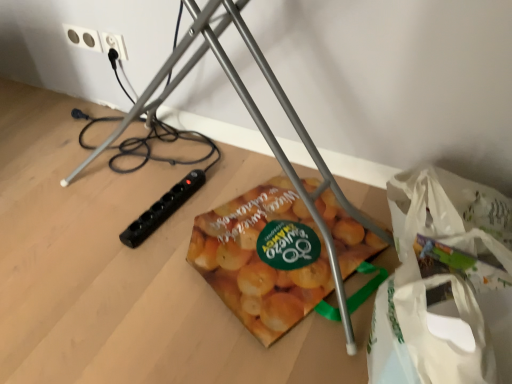
Question: Is black plastic power plug at upper left, acting as the second power plugs and sockets starting from the left, in front of or behind white plastic bag at lower right in the image?

Choices:
 (A) front
 (B) behind

Answer: (B)

Question: Is black plastic power plug at upper left, marked as the first power plugs and sockets in a right-to-left arrangement, taller or shorter than white plastic bag at lower right?

Choices:
 (A) tall
 (B) short

Answer: (B)

Question: Which object is the closest to the black plastic power plug at upper left, marked as the first power plugs and sockets in a right-to-left arrangement?

Choices:
 (A) metallic tripod at center
 (B) white plastic power plugs and sockets at upper left, the 1th power plugs and sockets viewed from the left
 (C) matte plastic bag of sweet potatoes at center
 (D) white plastic bag at lower right

Answer: (B)

Question: Estimate the real-world distances between objects in this image. Which object is farther from the metallic tripod at center?

Choices:
 (A) matte plastic bag of sweet potatoes at center
 (B) black plastic power plug at upper left, acting as the second power plugs and sockets starting from the left
 (C) white plastic power plugs and sockets at upper left, the 1th power plugs and sockets viewed from the left
 (D) white plastic bag at lower right

Answer: (C)